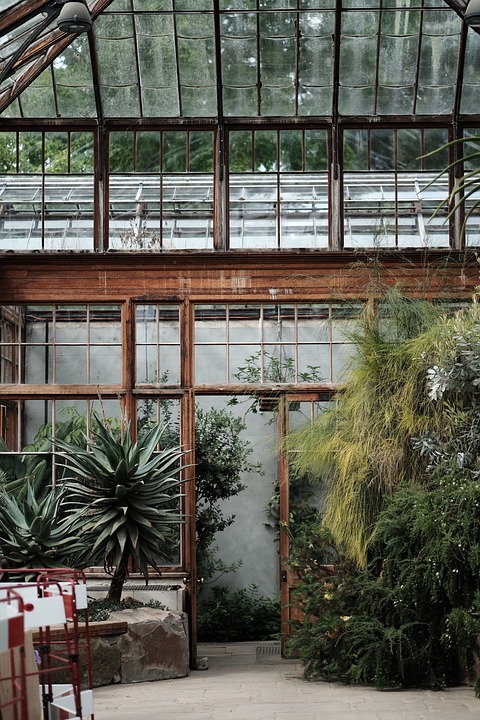
Image resolution: width=480 pixels, height=720 pixels. I want to click on green plants, so click(371, 551), click(471, 490), click(435, 546), click(387, 620), click(241, 616).